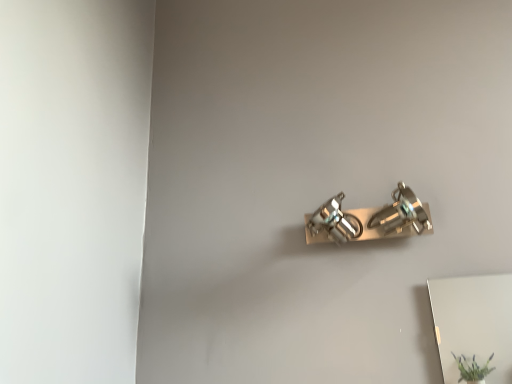
The height and width of the screenshot is (384, 512). What do you see at coordinates (369, 220) in the screenshot? I see `polished metallic door handle at center` at bounding box center [369, 220].

At what (x,y) coordinates should I click in order to perform the action: click on polished metallic door handle at center. Please return your answer as a coordinate pair (x, y). Image resolution: width=512 pixels, height=384 pixels. Looking at the image, I should click on (369, 220).

Where is `polished metallic door handle at center`? polished metallic door handle at center is located at coordinates (369, 220).